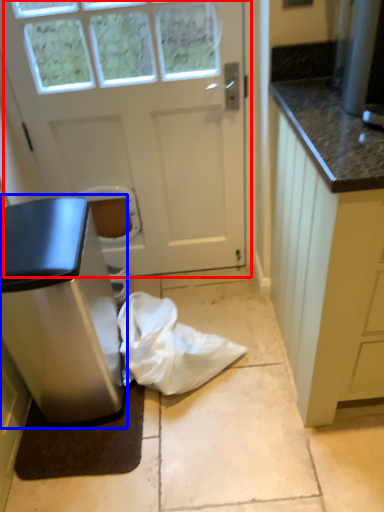
Question: Which object is further to the camera taking this photo, door (highlighted by a red box) or home appliance (highlighted by a blue box)?

Choices:
 (A) door
 (B) home appliance

Answer: (A)